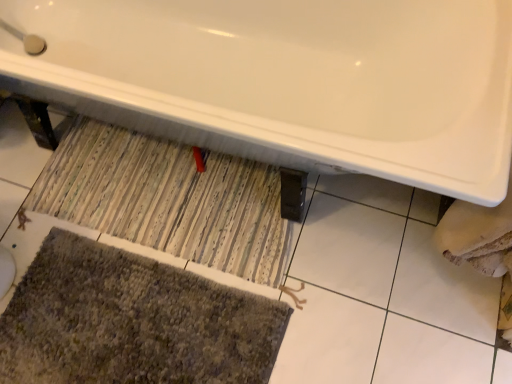
Identify the location of vacant area that is situated to the right of textured gray bath mat at lower left. (330, 278).